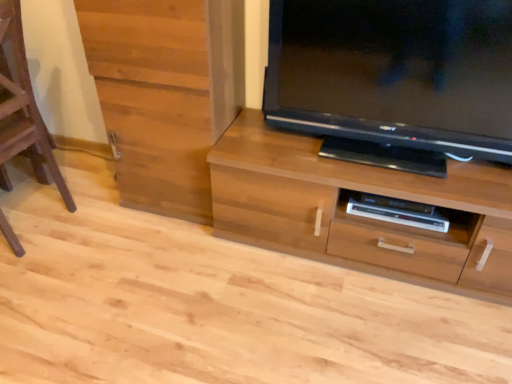
In order to click on vacant region below black glossy television at upper right (from a real-world perspective) in this screenshot , I will do `click(384, 158)`.